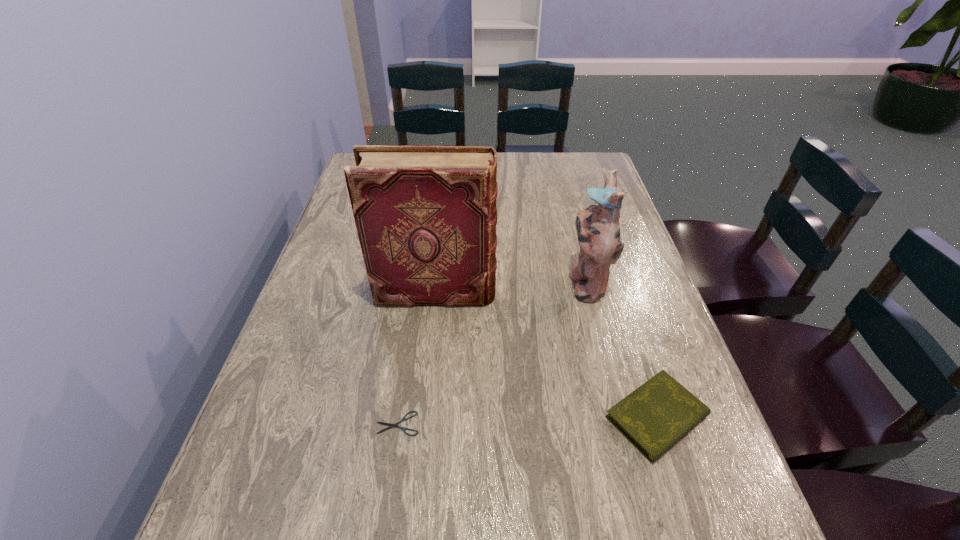
Find the location of `vacant area between the tallest object and the shears`. vacant area between the tallest object and the shears is located at coordinates (418, 358).

Locate an element on the screen. vacant space in between the second tallest object and the hardback book is located at coordinates (511, 288).

Where is `free area in between the shortest object and the diary`? This screenshot has width=960, height=540. free area in between the shortest object and the diary is located at coordinates (527, 420).

Locate an element on the screen. The image size is (960, 540). free point between the figurine and the third tallest object is located at coordinates (621, 350).

The height and width of the screenshot is (540, 960). In order to click on vacant point located between the tallest object and the second tallest object in this screenshot , I will do `click(511, 288)`.

The image size is (960, 540). I want to click on blank region between the figurine and the hardback book, so click(x=511, y=288).

You are a GUI agent. You are given a task and a screenshot of the screen. Output one action in this format:
    pyautogui.click(x=<x>, y=<y>)
    Task: Click on the object that stands as the closest to the second tallest object
    Image resolution: width=960 pixels, height=540 pixels.
    Given the screenshot: What is the action you would take?
    pyautogui.click(x=426, y=216)

This screenshot has height=540, width=960. In order to click on the second closest object to the third tallest object in this screenshot , I will do 426,216.

This screenshot has height=540, width=960. What are the coordinates of `vacant area in the image that satisfies the following two spatial constraints: 1. on the spine side of the third tallest object; 2. on the left side of the hardback book` in the screenshot? It's located at (423, 416).

Find the location of `free space in the image that satisfies the following two spatial constraints: 1. on the spine side of the hardback book; 2. on the front side of the shears`. free space in the image that satisfies the following two spatial constraints: 1. on the spine side of the hardback book; 2. on the front side of the shears is located at coordinates (423, 423).